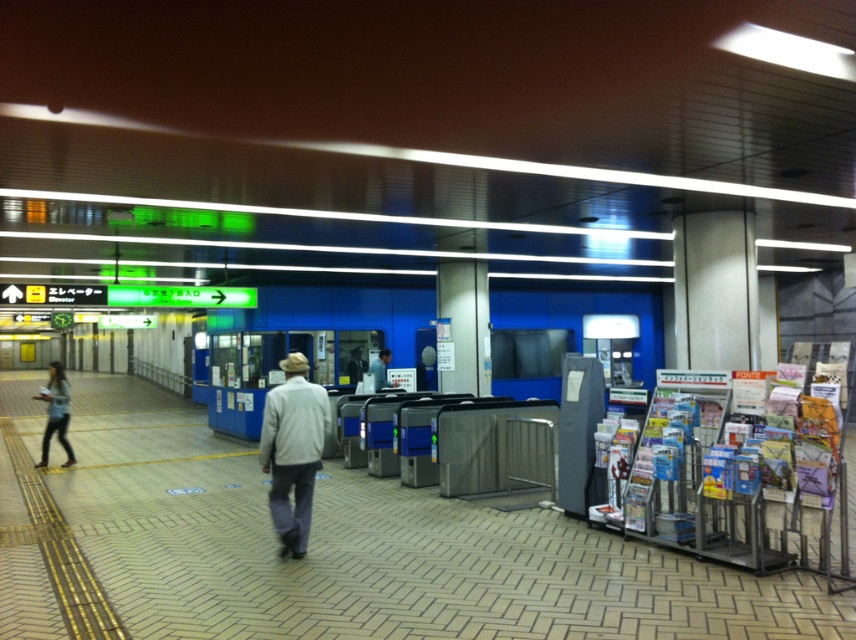
Question: Which object is positioned closest to the denim jacket at left?

Choices:
 (A) light gray fabric jacket at center
 (B) light blue shirt at center

Answer: (B)

Question: Observing the image, what is the correct spatial positioning of light gray fabric jacket at center in reference to light blue shirt at center?

Choices:
 (A) below
 (B) above

Answer: (A)

Question: Which object appears closest to the camera in this image?

Choices:
 (A) denim jacket at left
 (B) light blue shirt at center
 (C) light gray fabric jacket at center

Answer: (C)

Question: Can you confirm if light gray fabric jacket at center is positioned to the right of denim jacket at left?

Choices:
 (A) no
 (B) yes

Answer: (B)

Question: Estimate the real-world distances between objects in this image. Which object is closer to the denim jacket at left?

Choices:
 (A) light blue shirt at center
 (B) light gray fabric jacket at center

Answer: (A)

Question: Is light gray fabric jacket at center positioned behind light blue shirt at center?

Choices:
 (A) yes
 (B) no

Answer: (B)